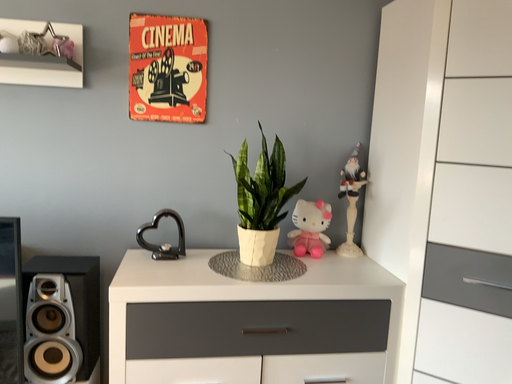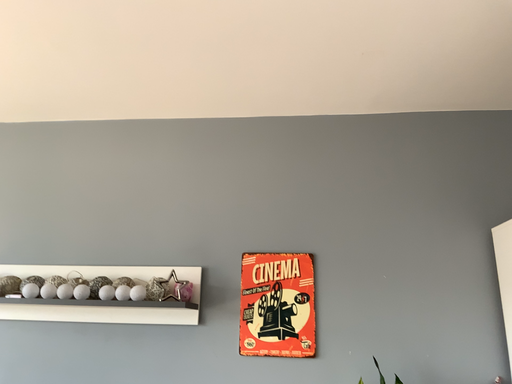
Question: Which way did the camera rotate in the video?

Choices:
 (A) rotated upward
 (B) rotated downward

Answer: (A)